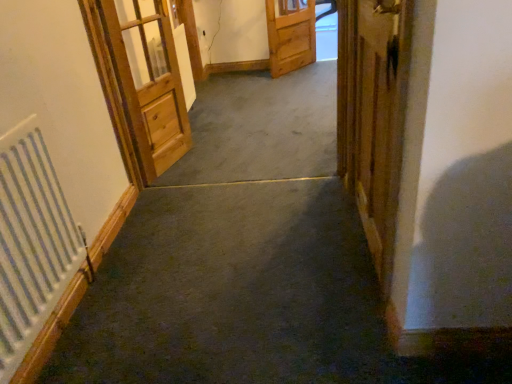
Question: Should I look upward or downward to see wooden door at center, placed as the second door when sorted from right to left?

Choices:
 (A) down
 (B) up

Answer: (B)

Question: Does wooden door at right, the third door in the left-to-right sequence, have a greater width compared to wooden drawer at center?

Choices:
 (A) no
 (B) yes

Answer: (A)

Question: Could you tell me if wooden door at right, the third door in the left-to-right sequence, is facing wooden drawer at center?

Choices:
 (A) no
 (B) yes

Answer: (A)

Question: Is wooden door at right, placed as the third door when sorted from back to front, thinner than wooden drawer at center?

Choices:
 (A) no
 (B) yes

Answer: (B)

Question: Considering the relative positions of wooden door at right, placed as the third door when sorted from back to front, and wooden drawer at center in the image provided, is wooden door at right, placed as the third door when sorted from back to front, behind wooden drawer at center?

Choices:
 (A) no
 (B) yes

Answer: (A)

Question: Considering the relative sizes of wooden door at right, placed as the first door when sorted from front to back, and wooden drawer at center in the image provided, is wooden door at right, placed as the first door when sorted from front to back, taller than wooden drawer at center?

Choices:
 (A) no
 (B) yes

Answer: (B)

Question: Are wooden door at right, acting as the 1th door starting from the right, and wooden drawer at center far apart?

Choices:
 (A) yes
 (B) no

Answer: (A)

Question: Is wooden drawer at center thinner than light brown wooden door at left, the 1th door viewed from the left?

Choices:
 (A) no
 (B) yes

Answer: (B)

Question: Considering the relative sizes of wooden drawer at center and light brown wooden door at left, which ranks as the 3th door in right-to-left order, in the image provided, is wooden drawer at center bigger than light brown wooden door at left, which ranks as the 3th door in right-to-left order,?

Choices:
 (A) yes
 (B) no

Answer: (B)

Question: Is wooden drawer at center outside of light brown wooden door at left, marked as the second door in a back-to-front arrangement?

Choices:
 (A) yes
 (B) no

Answer: (A)

Question: Does wooden drawer at center turn towards light brown wooden door at left, arranged as the second door when viewed from the front?

Choices:
 (A) yes
 (B) no

Answer: (B)

Question: Is wooden drawer at center wider than light brown wooden door at left, arranged as the second door when viewed from the front?

Choices:
 (A) no
 (B) yes

Answer: (A)

Question: Is wooden drawer at center further to the viewer compared to light brown wooden door at left, arranged as the second door when viewed from the front?

Choices:
 (A) no
 (B) yes

Answer: (B)

Question: Is white metallic radiator at left completely or partially inside light brown wooden door at left, the 1th door viewed from the left?

Choices:
 (A) no
 (B) yes

Answer: (A)